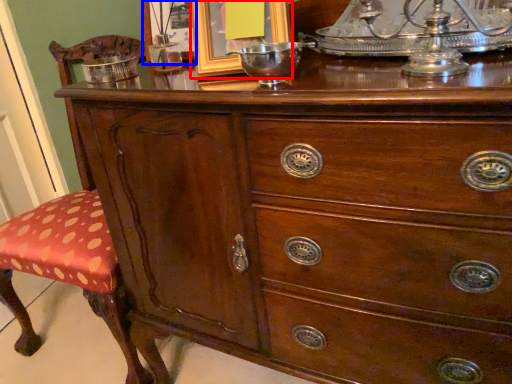
Question: Which of the following is the closest to the observer, picture frame (highlighted by a red box) or picture frame (highlighted by a blue box)?

Choices:
 (A) picture frame
 (B) picture frame

Answer: (A)